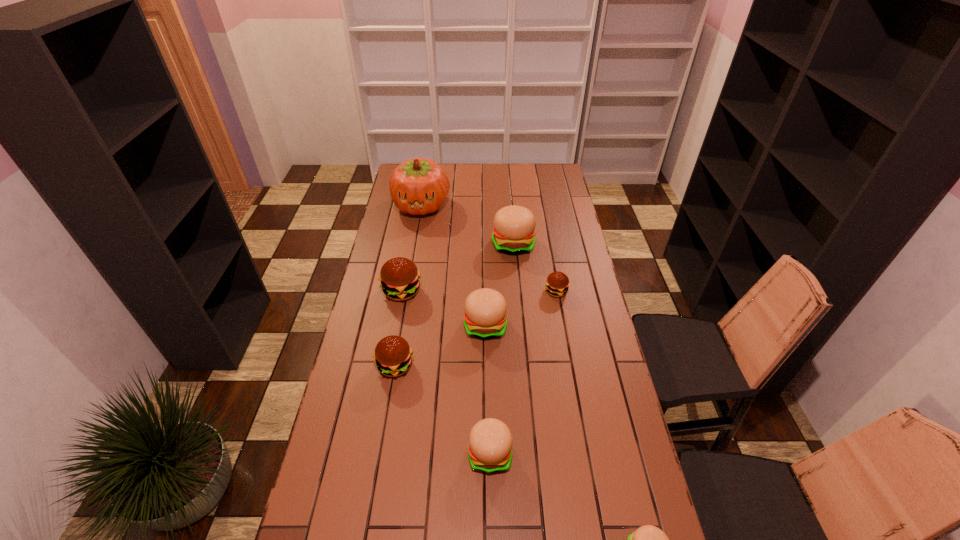
Where is `the second nearest object`? the second nearest object is located at coordinates (490, 441).

The image size is (960, 540). I want to click on the smallest brown hamburger, so click(x=557, y=283).

Image resolution: width=960 pixels, height=540 pixels. I want to click on the sixth hamburger from left to right, so click(557, 283).

I want to click on vacant space positioned 0.330m on the side of the tallest object with the cute face, so coord(411,269).

Where is `free space located on the back of the farthest beige hamburger`? This screenshot has width=960, height=540. free space located on the back of the farthest beige hamburger is located at coordinates (511, 222).

This screenshot has height=540, width=960. In order to click on vacant space located on the front of the biggest brown hamburger in this screenshot , I will do `click(383, 392)`.

Where is `free location located on the back of the fourth nearest object`? free location located on the back of the fourth nearest object is located at coordinates (485, 256).

Locate an element on the screen. Image resolution: width=960 pixels, height=540 pixels. free space located 0.230m on the right of the nearest brown hamburger is located at coordinates (483, 366).

Locate an element on the screen. The width and height of the screenshot is (960, 540). vacant region located 0.070m on the left of the second nearest beige hamburger is located at coordinates (444, 453).

Locate an element on the screen. The width and height of the screenshot is (960, 540). vacant area situated 0.330m on the back of the sixth hamburger from left to right is located at coordinates point(546,233).